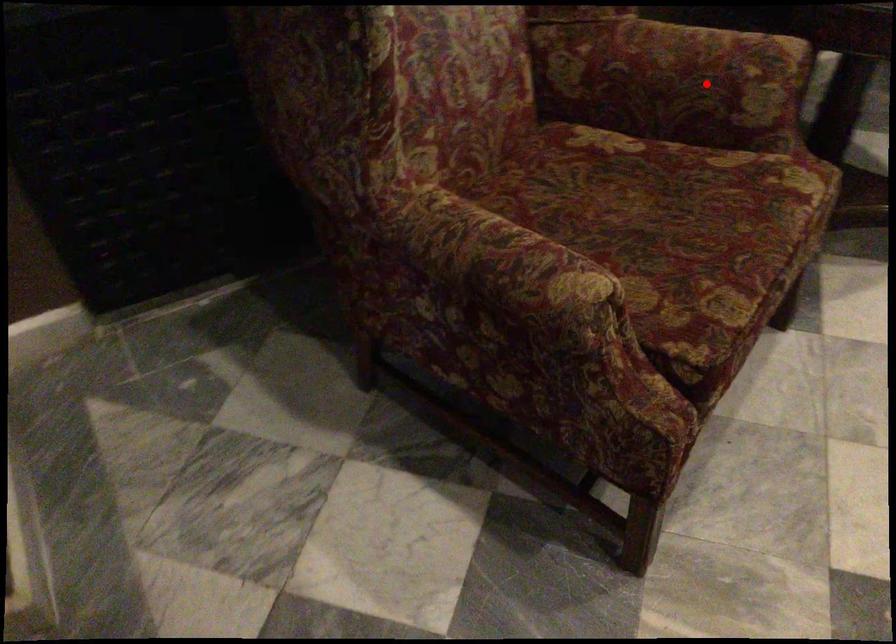
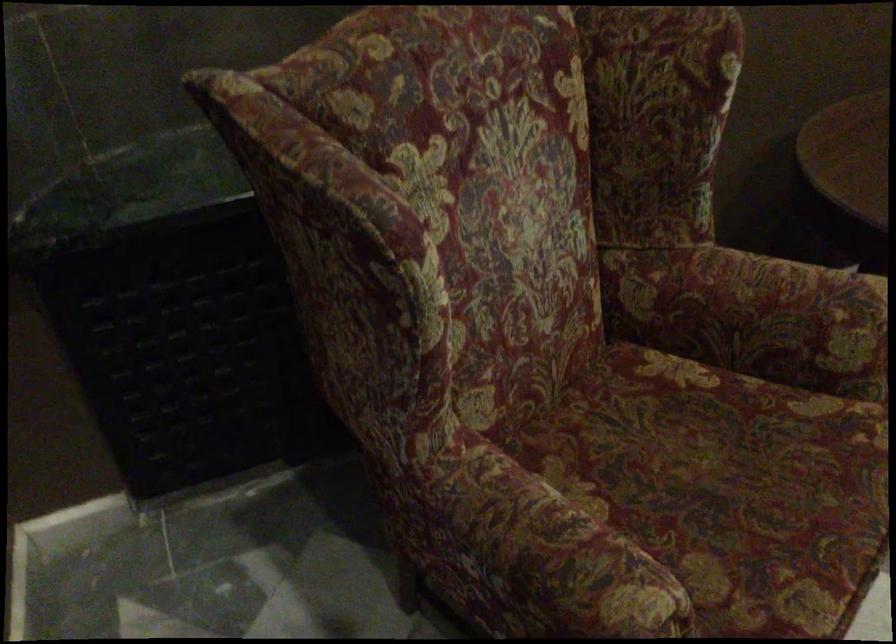
In the second image, find the point that corresponds to the highlighted location in the first image.

(786, 321)